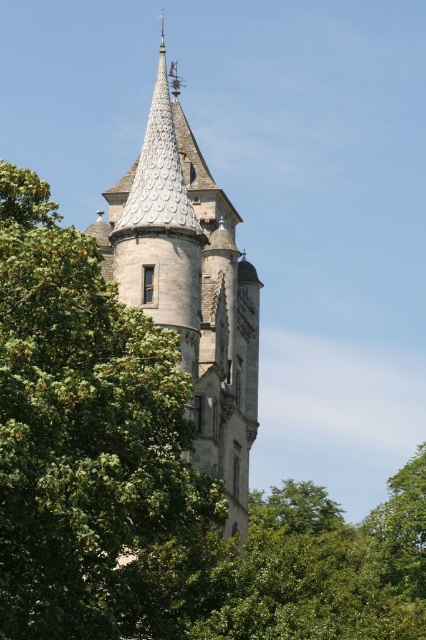
You are standing in front of the castle tower and notice a green leafy tree at center. Based on its coordinates, is the tree positioned closer to the top or bottom of the image?

The green leafy tree at center is located at point 0.700 in the x and 0.218 in the y coordinate. Since the y coordinate is closer to 0, which typically represents the bottom of an image, the tree is positioned closer to the bottom of the image.

You are standing in front of the castle tower and notice a green leafy tree at center and a stone steeple at center. Which object is positioned to the left when viewed from your perspective?

The green leafy tree at center is positioned to the left of the stone steeple at center.

You are standing in front of the castle tower and see both the green leafy tree at center and the stone steeple at center. Which object is positioned closer to you?

The green leafy tree at center is closer to the viewer than the stone steeple at center.